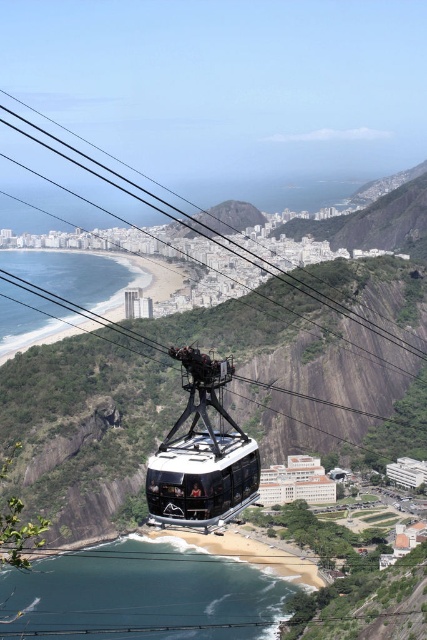
You are a tour guide explaining the cable car route to visitors. Where exactly is the shiny black cable car at center located in terms of coordinates?

The shiny black cable car at center is located at coordinates point (x=201, y=452).

In the scene shown: You are inside the cable car and looking out. There are two points marked in the scene. The first point is at coordinates point [199,396] and the second is at point [193,216]. Which point is closer to you?

Point [199,396] is closer to the viewer than point [193,216].

You are a passenger in the shiny black cable car at center and want to look out the window to see the green rock at center. Which side of the cable car should you look to find it?

The shiny black cable car at center is to the left of green rock at center, so you should look to the right side of the cable car to find the green rock at center.